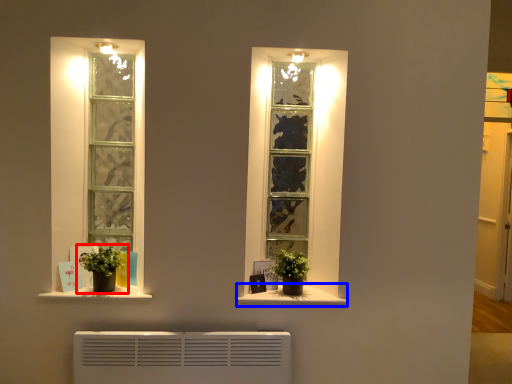
Question: Which of the following is the closest to the observer, houseplant (highlighted by a red box) or window sill (highlighted by a blue box)?

Choices:
 (A) houseplant
 (B) window sill

Answer: (A)